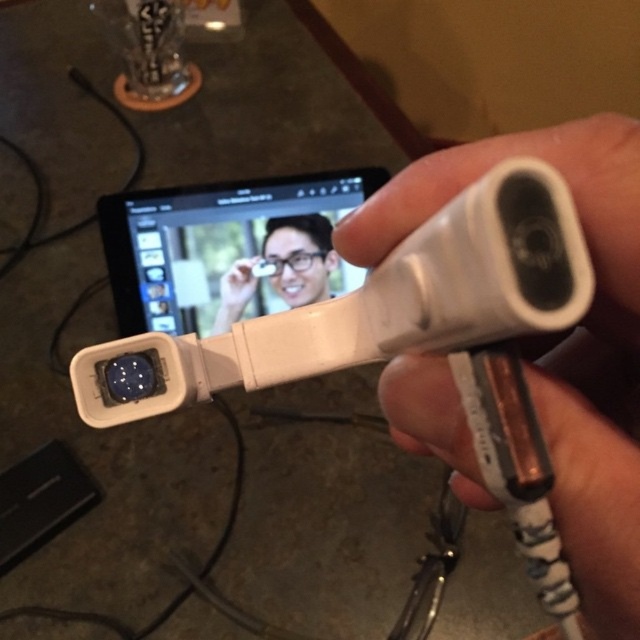
From the picture: You are holding a ruler and want to measure the distance from your eyes to the white matte plastic controller at center in the image. If the ruler is 12 inches long, can you fully extend it to measure the distance?

The distance between the white matte plastic controller at center and the viewer is 6.41 inches, so yes, the ruler can be fully extended to measure the distance since it is shorter than the ruler length.

You are setting up a Nintendo Wii system and have both the white matte plastic controller at center and the white plastic remote control at center in front of you. Which one is narrower?

The white matte plastic controller at center is narrower than the white plastic remote control at center.

You are setting up a gaming station and need to place the white matte plastic controller at center and the black glossy tablet at center on a shelf. According to the image, which object should be placed lower on the shelf?

The white matte plastic controller at center should be placed lower on the shelf because it is located below the black glossy tablet at center in the image.